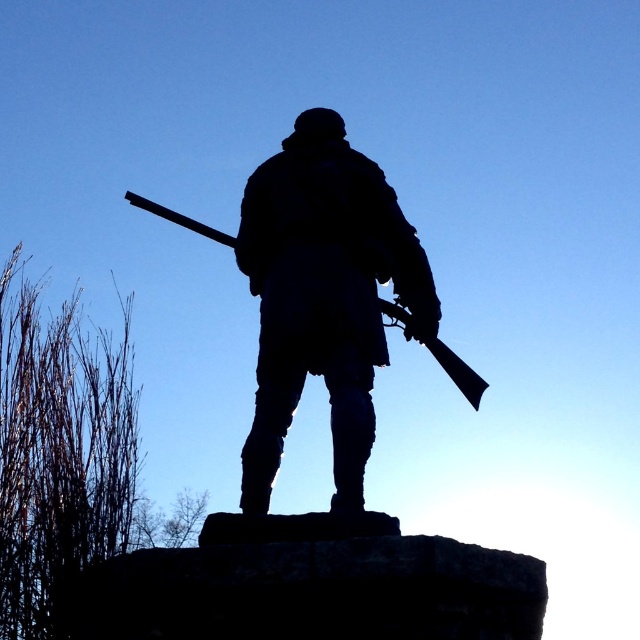
Question: Can you confirm if silhouette stone statue at center is thinner than silhouette wood shotgun at center?

Choices:
 (A) yes
 (B) no

Answer: (A)

Question: Which point is farther from the camera taking this photo?

Choices:
 (A) (476, 381)
 (B) (358, 170)

Answer: (A)

Question: Does silhouette stone statue at center come in front of silhouette wood shotgun at center?

Choices:
 (A) no
 (B) yes

Answer: (B)

Question: Does silhouette stone statue at center appear under silhouette wood shotgun at center?

Choices:
 (A) yes
 (B) no

Answer: (A)

Question: Among these points, which one is nearest to the camera?

Choices:
 (A) (300, 308)
 (B) (131, 200)

Answer: (A)